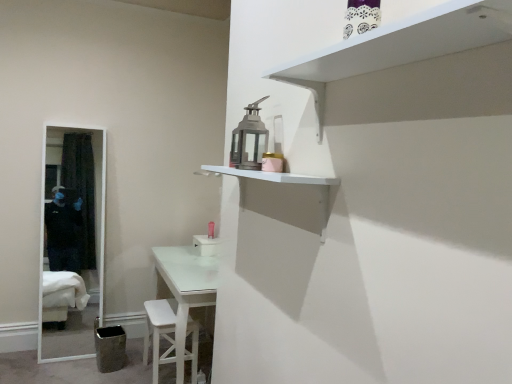
Identify the location of pink matte toiletry at center. (211, 229).

In order to face white matte shelf at upper center, placed as the second shelf when sorted from top to bottom, should I rotate leftwards or rightwards?

A 0.347 degree turn to the left will do.

This screenshot has height=384, width=512. Identify the location of white wooden stool at lower center. (159, 332).

How many degrees apart are the facing directions of white matte shelf at upper center, placed as the 1th shelf when sorted from bottom to top, and white wooden stool at lower center?

The angle between the facing direction of white matte shelf at upper center, placed as the 1th shelf when sorted from bottom to top, and the facing direction of white wooden stool at lower center is 0.308 degrees.

Could white wooden stool at lower center be considered to be inside white matte shelf at upper center, placed as the 1th shelf when sorted from bottom to top?

No, white wooden stool at lower center is not surrounded by white matte shelf at upper center, placed as the 1th shelf when sorted from bottom to top.

Is white matte shelf at upper center, placed as the 1th shelf when sorted from bottom to top, aimed at white wooden stool at lower center?

No, white matte shelf at upper center, placed as the 1th shelf when sorted from bottom to top, does not turn towards white wooden stool at lower center.

Considering the relative sizes of white matte shelf at upper center, placed as the 1th shelf when sorted from bottom to top, and white wooden stool at lower center in the image provided, is white matte shelf at upper center, placed as the 1th shelf when sorted from bottom to top, taller than white wooden stool at lower center?

Incorrect, the height of white matte shelf at upper center, placed as the 1th shelf when sorted from bottom to top, is not larger of that of white wooden stool at lower center.

Consider the image. Can you tell me how much pink matte toiletry at center and white matte shelf at upper right, which is the 1th shelf in top-to-bottom order, differ in facing direction?

They differ by 0.211 degrees in their facing directions.

Is pink matte toiletry at center bigger than white matte shelf at upper right, acting as the second shelf starting from the bottom?

Incorrect, pink matte toiletry at center is not larger than white matte shelf at upper right, acting as the second shelf starting from the bottom.

Is point (214, 224) positioned in front of point (345, 66)?

No, (214, 224) is further to viewer.

Between point (459, 14) and point (320, 222), which one is positioned in front?

The point (459, 14) is closer to the camera.

From a real-world perspective, which is physically above, white matte shelf at upper right, which is the 1th shelf in top-to-bottom order, or white matte shelf at upper center, placed as the 1th shelf when sorted from bottom to top?

white matte shelf at upper right, which is the 1th shelf in top-to-bottom order, is physically above.

Are white matte shelf at upper right, which is the 1th shelf in top-to-bottom order, and white matte shelf at upper center, placed as the 1th shelf when sorted from bottom to top, far apart?

white matte shelf at upper right, which is the 1th shelf in top-to-bottom order, is actually quite close to white matte shelf at upper center, placed as the 1th shelf when sorted from bottom to top.

Is white wooden stool at lower center smaller than white matte shelf at upper center, placed as the second shelf when sorted from top to bottom?

No, white wooden stool at lower center is not smaller than white matte shelf at upper center, placed as the second shelf when sorted from top to bottom.

Is white wooden stool at lower center positioned before white matte shelf at upper center, placed as the second shelf when sorted from top to bottom?

No, it is not.

Based on their positions, is white wooden stool at lower center located to the left or right of white matte shelf at upper center, placed as the second shelf when sorted from top to bottom?

white wooden stool at lower center is to the left of white matte shelf at upper center, placed as the second shelf when sorted from top to bottom.

Considering the positions of objects white wooden stool at lower center and white matte shelf at upper right, which is the 1th shelf in top-to-bottom order, in the image provided, who is in front, white wooden stool at lower center or white matte shelf at upper right, which is the 1th shelf in top-to-bottom order,?

white matte shelf at upper right, which is the 1th shelf in top-to-bottom order, is in front.

Is white wooden stool at lower center not close to white matte shelf at upper right, acting as the second shelf starting from the bottom?

white wooden stool at lower center is far away from white matte shelf at upper right, acting as the second shelf starting from the bottom.

Which of these two, white wooden stool at lower center or white matte shelf at upper right, acting as the second shelf starting from the bottom, is bigger?

white wooden stool at lower center is bigger.

Based on the photo, which of these two, white wooden stool at lower center or white matte shelf at upper right, which is the 1th shelf in top-to-bottom order, stands taller?

With more height is white wooden stool at lower center.

Can you confirm if white wooden stool at lower center is taller than pink matte toiletry at center?

Correct, white wooden stool at lower center is much taller as pink matte toiletry at center.

Is white wooden stool at lower center oriented away from pink matte toiletry at center?

white wooden stool at lower center is not turned away from pink matte toiletry at center.

Is white wooden stool at lower center not within pink matte toiletry at center?

Absolutely, white wooden stool at lower center is external to pink matte toiletry at center.

Between point (154, 321) and point (213, 225), which one is positioned behind?

The point (213, 225) is farther from the camera.

Is white matte shelf at upper center, placed as the 1th shelf when sorted from bottom to top, in contact with pink matte toiletry at center?

No, white matte shelf at upper center, placed as the 1th shelf when sorted from bottom to top, is not beside pink matte toiletry at center.

Consider the image. Which is less distant, (232, 174) or (212, 223)?

Clearly, point (232, 174) is closer to the camera than point (212, 223).

Which object is thinner, white matte shelf at upper center, placed as the second shelf when sorted from top to bottom, or pink matte toiletry at center?

Thinner between the two is pink matte toiletry at center.

Does white matte shelf at upper center, placed as the second shelf when sorted from top to bottom, have a lesser height compared to pink matte toiletry at center?

In fact, white matte shelf at upper center, placed as the second shelf when sorted from top to bottom, may be taller than pink matte toiletry at center.

Locate an element on the screen. The width and height of the screenshot is (512, 384). the 1st shelf to the right when counting from the white wooden stool at lower center is located at coordinates (280, 183).

Where is `shelf that is the 2nd one when counting forward from the pink matte toiletry at center`? The height and width of the screenshot is (384, 512). shelf that is the 2nd one when counting forward from the pink matte toiletry at center is located at coordinates (400, 46).

Considering their positions, is white matte shelf at upper center, placed as the 1th shelf when sorted from bottom to top, positioned closer to pink matte toiletry at center than white matte shelf at upper right, acting as the second shelf starting from the bottom?

white matte shelf at upper center, placed as the 1th shelf when sorted from bottom to top, is closer to pink matte toiletry at center.

Estimate the real-world distances between objects in this image. Which object is closer to white wooden stool at lower center, white matte shelf at upper right, which is the 1th shelf in top-to-bottom order, or white matte shelf at upper center, placed as the second shelf when sorted from top to bottom?

Among the two, white matte shelf at upper center, placed as the second shelf when sorted from top to bottom, is located nearer to white wooden stool at lower center.

Considering their positions, is white matte shelf at upper center, placed as the 1th shelf when sorted from bottom to top, positioned closer to pink matte toiletry at center than white wooden stool at lower center?

white wooden stool at lower center lies closer to pink matte toiletry at center than the other object.

From the image, which object appears to be farther from white matte shelf at upper center, placed as the 1th shelf when sorted from bottom to top, white wooden stool at lower center or pink matte toiletry at center?

pink matte toiletry at center is positioned further to the anchor white matte shelf at upper center, placed as the 1th shelf when sorted from bottom to top.

Estimate the real-world distances between objects in this image. Which object is further from white matte shelf at upper right, acting as the second shelf starting from the bottom, white wooden stool at lower center or white matte shelf at upper center, placed as the 1th shelf when sorted from bottom to top?

The object further to white matte shelf at upper right, acting as the second shelf starting from the bottom, is white wooden stool at lower center.

When comparing their distances from white matte shelf at upper right, which is the 1th shelf in top-to-bottom order, does white wooden stool at lower center or pink matte toiletry at center seem closer?

white wooden stool at lower center.

Considering their positions, is pink matte toiletry at center positioned further to white wooden stool at lower center than white matte shelf at upper center, placed as the 1th shelf when sorted from bottom to top?

Among the two, white matte shelf at upper center, placed as the 1th shelf when sorted from bottom to top, is located further to white wooden stool at lower center.

When comparing their distances from white wooden stool at lower center, does white matte shelf at upper right, which is the 1th shelf in top-to-bottom order, or pink matte toiletry at center seem further?

white matte shelf at upper right, which is the 1th shelf in top-to-bottom order, is positioned further to the anchor white wooden stool at lower center.

You are a GUI agent. You are given a task and a screenshot of the screen. Output one action in this format:
    pyautogui.click(x=<x>, y=<y>)
    Task: Click on the step stool positioned between white matte shelf at upper center, placed as the second shelf when sorted from top to bottom, and pink matte toiletry at center from near to far
    
    Given the screenshot: What is the action you would take?
    pyautogui.click(x=159, y=332)

Find the location of a particular element. step stool positioned between white matte shelf at upper right, acting as the second shelf starting from the bottom, and pink matte toiletry at center from near to far is located at coordinates click(x=159, y=332).

Identify the location of shelf between white matte shelf at upper right, which is the 1th shelf in top-to-bottom order, and white wooden stool at lower center in the front-back direction. (280, 183).

I want to click on shelf positioned between white matte shelf at upper right, acting as the second shelf starting from the bottom, and pink matte toiletry at center from near to far, so click(280, 183).